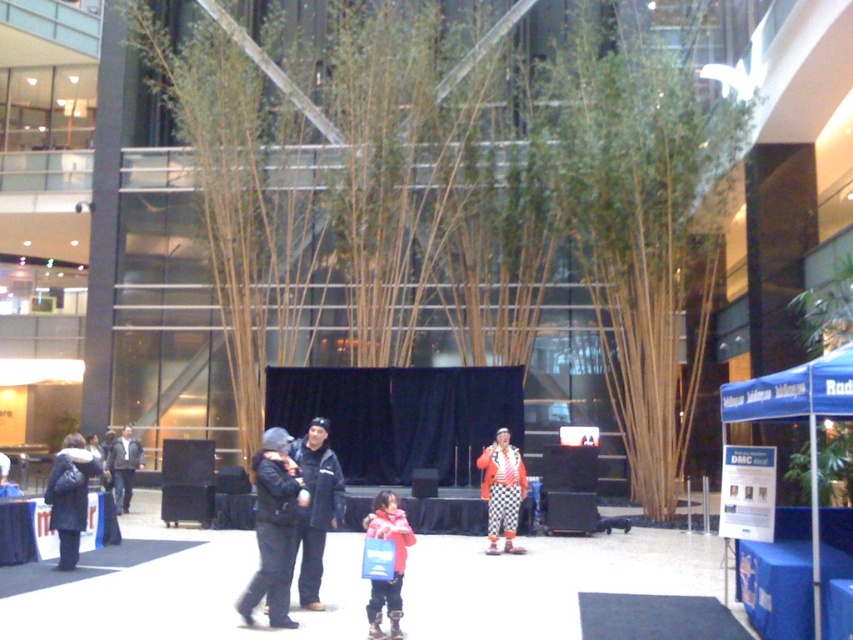
You are standing in the event space and see a point marked at coordinates (70, 496). Based on the scene description, where is this point located?

The point at coordinates (70, 496) is located on the matte black coat at left.

You are planning to place a new decorative item between the brown wood tree at center and the dark gray jacket at left. Which object should you consider the width of to ensure the item fits properly?

You should consider the width of the brown wood tree at center because it might be wider than the dark gray jacket at left, so the decorative item needs to accommodate its width to fit properly.